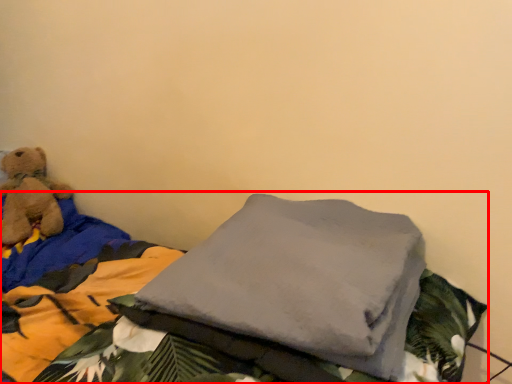
Question: In this image, where is bed (annotated by the red box) located relative to teddy bear?

Choices:
 (A) right
 (B) left

Answer: (A)